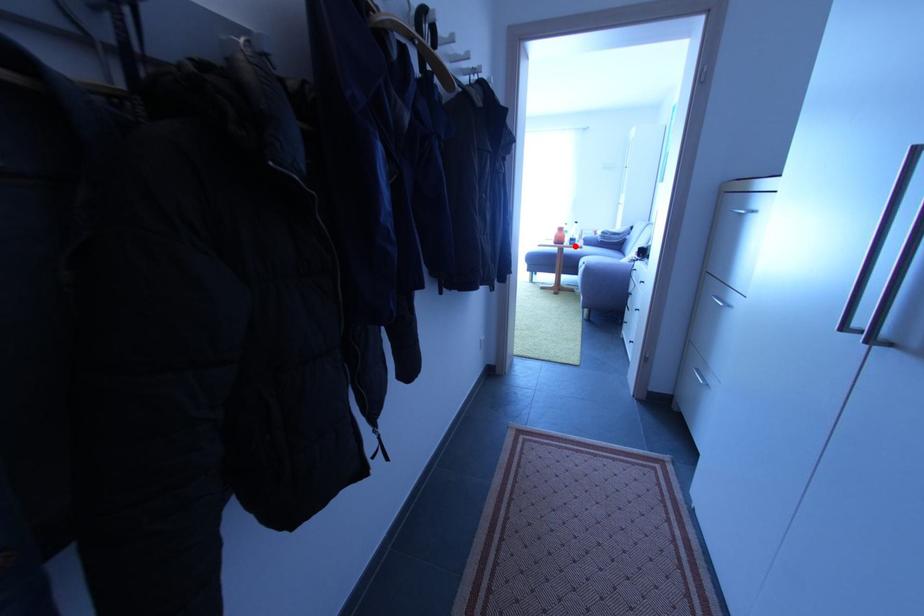
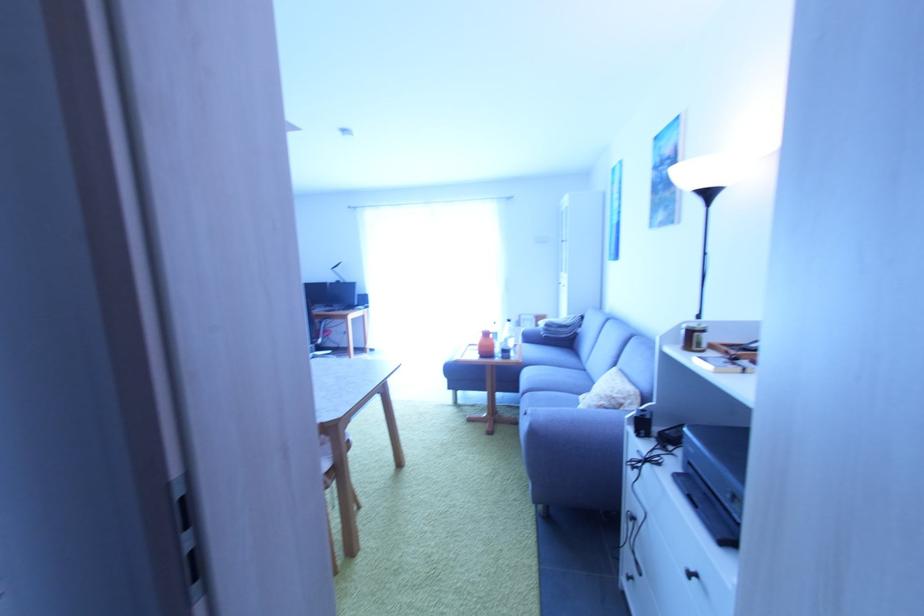
Question: I am providing you with two images of the same scene from different viewpoints. A red point is shown in image1. For the corresponding object point in image2, is it positioned nearer or farther from the camera?

Choices:
 (A) Nearer
 (B) Farther

Answer: (B)